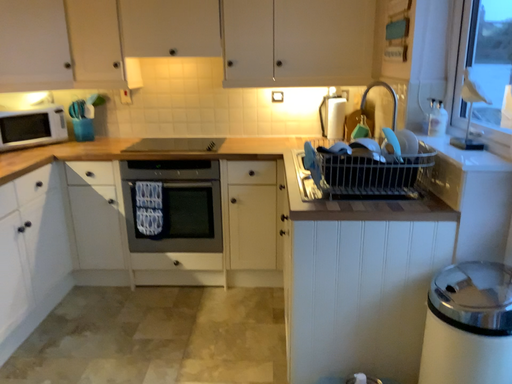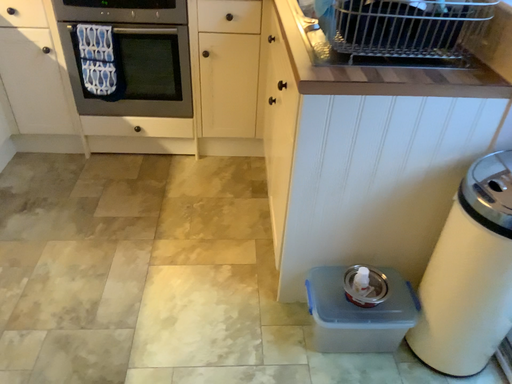
Question: Which way did the camera rotate in the video?

Choices:
 (A) rotated upward
 (B) rotated downward

Answer: (B)